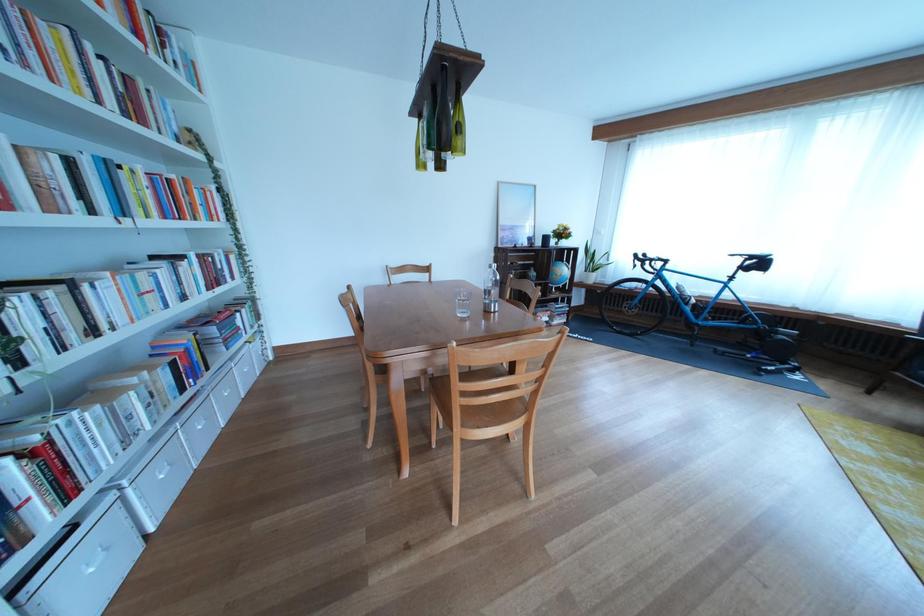
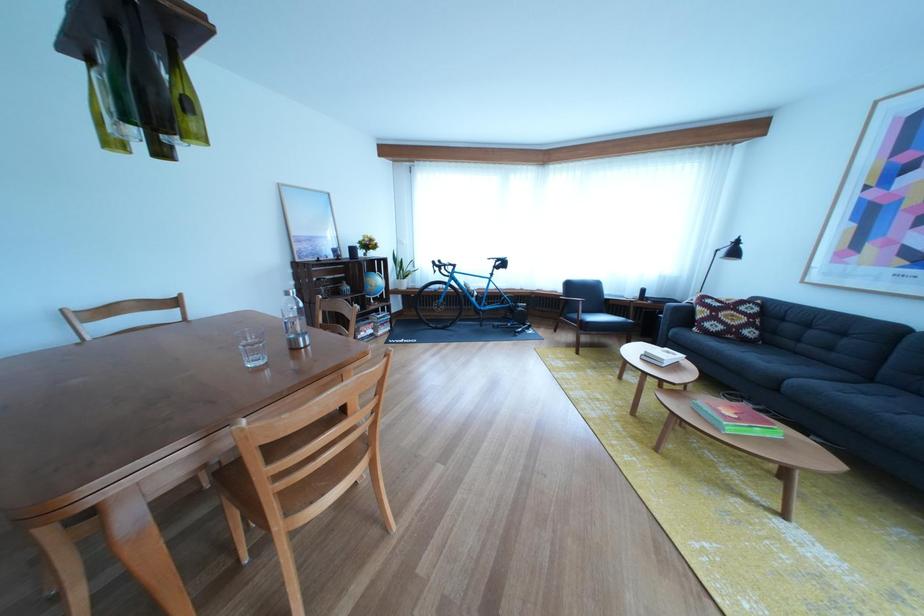
Locate, in the second image, the point that corresponds to (x=477, y=307) in the first image.

(265, 351)